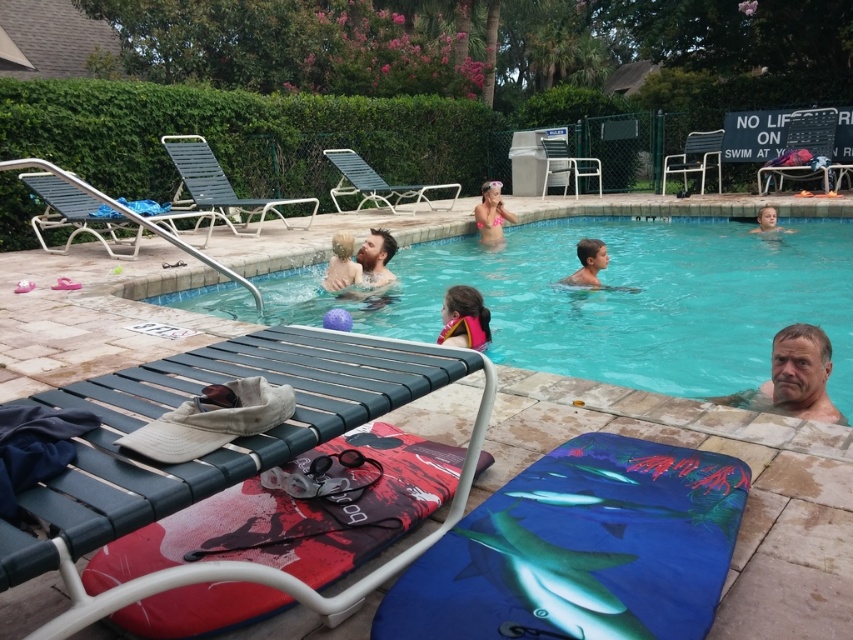
You are standing at the edge of the pool and want to reach both the point at coordinates point [381,275] and the point at coordinates point [590,244]. Which point will you reach first if you walk directly towards them?

The point at coordinates point [381,275] is closer to you than the point at coordinates point [590,244], so you will reach point [381,275] first.

You are standing at the edge of the pool and want to reach the point marked at coordinates (x=384, y=236). If your longest pool noodle is 4 meters long, can you reach that point using the noodle?

The point at coordinates (x=384, y=236) is 4.57 meters away from the viewer. Since the noodle is only 4 meters long, it is not long enough to reach that point.